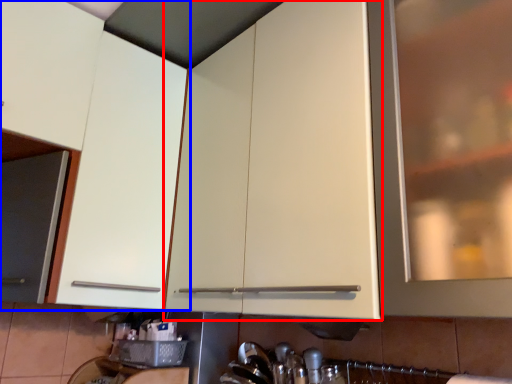
Question: Among these objects, which one is nearest to the camera, cabinetry (highlighted by a red box) or cabinetry (highlighted by a blue box)?

Choices:
 (A) cabinetry
 (B) cabinetry

Answer: (A)